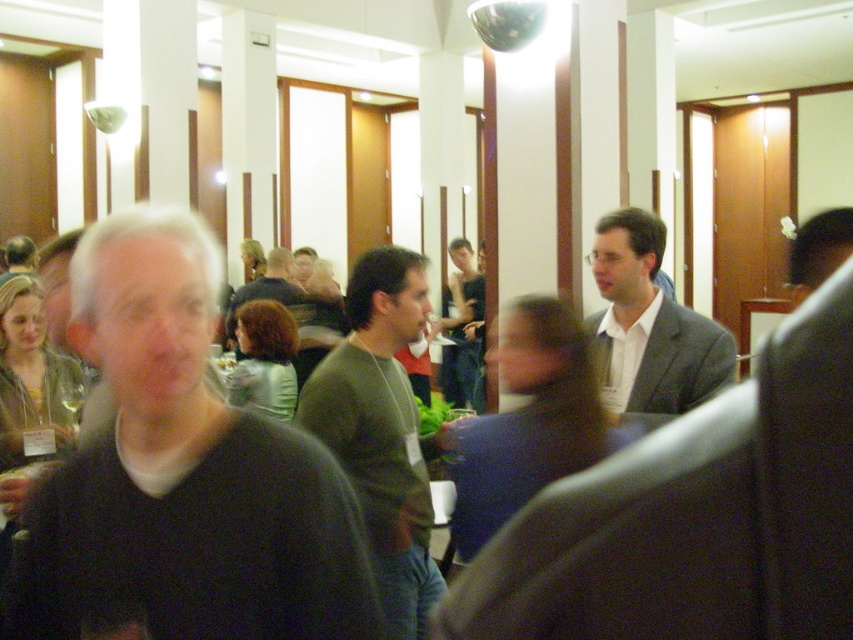
Is green matte sweater at center wider than light gray suit at center?

No, green matte sweater at center is not wider than light gray suit at center.

Does green matte sweater at center appear over light gray suit at center?

Actually, green matte sweater at center is below light gray suit at center.

Where is `green matte sweater at center`? green matte sweater at center is located at coordinates (381, 428).

Which of these two, dark gray sweater at center or green matte sweater at center, stands taller?

green matte sweater at center is taller.

Can you confirm if dark gray sweater at center is bigger than green matte sweater at center?

Actually, dark gray sweater at center might be smaller than green matte sweater at center.

Which is in front, point (103, 364) or point (418, 538)?

Point (103, 364)

What are the coordinates of `dark gray sweater at center` in the screenshot? It's located at (184, 474).

Between white shirt at center and green matte shirt at center, which one appears on the right side from the viewer's perspective?

Positioned to the right is white shirt at center.

Does white shirt at center lie behind green matte shirt at center?

No, white shirt at center is closer to the viewer.

Who is more forward, (495, 472) or (450, 380)?

Point (495, 472) is in front.

I want to click on white shirt at center, so click(x=527, y=420).